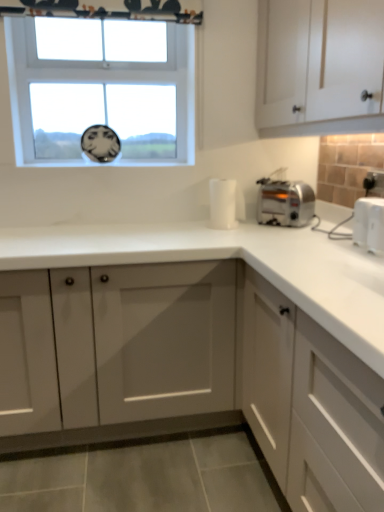
Question: Is white matte cabinet at lower right, the third cabinetry when ordered from top to bottom, to the left of white plastic toaster at right from the viewer's perspective?

Choices:
 (A) yes
 (B) no

Answer: (A)

Question: Can you confirm if white matte cabinet at lower right, the third cabinetry when ordered from top to bottom, is positioned to the right of white plastic toaster at right?

Choices:
 (A) yes
 (B) no

Answer: (B)

Question: From the image's perspective, is white matte cabinet at lower right, which is the 1th cabinetry from bottom to top, above white plastic toaster at right?

Choices:
 (A) no
 (B) yes

Answer: (A)

Question: Would you say white plastic toaster at right is part of white matte cabinet at lower right, which is the 1th cabinetry from bottom to top,'s contents?

Choices:
 (A) yes
 (B) no

Answer: (B)

Question: From the image's perspective, is clear glass window at upper center above or below white matte cabinet at lower right, which is the 1th cabinetry from bottom to top?

Choices:
 (A) above
 (B) below

Answer: (A)

Question: Is clear glass window at upper center situated inside white matte cabinet at lower right, which is the 1th cabinetry from bottom to top, or outside?

Choices:
 (A) inside
 (B) outside

Answer: (B)

Question: Does point (31, 46) appear closer or farther from the camera than point (284, 345)?

Choices:
 (A) farther
 (B) closer

Answer: (A)

Question: Is clear glass window at upper center taller or shorter than white matte cabinet at lower right, which is the 1th cabinetry from bottom to top?

Choices:
 (A) tall
 (B) short

Answer: (B)

Question: Relative to satin silver toaster at right, is clear glass window at upper center in front or behind?

Choices:
 (A) behind
 (B) front

Answer: (A)

Question: Is clear glass window at upper center wider or thinner than satin silver toaster at right?

Choices:
 (A) thin
 (B) wide

Answer: (A)

Question: Which is correct: clear glass window at upper center is inside satin silver toaster at right, or outside of it?

Choices:
 (A) inside
 (B) outside

Answer: (B)

Question: Visually, is clear glass window at upper center positioned to the left or to the right of satin silver toaster at right?

Choices:
 (A) right
 (B) left

Answer: (B)

Question: Is white plastic toaster at right inside or outside of white matte cabinet at lower right, which is the 1th cabinetry from bottom to top?

Choices:
 (A) outside
 (B) inside

Answer: (A)

Question: From a real-world perspective, is white plastic toaster at right positioned above or below white matte cabinet at lower right, which is the 1th cabinetry from bottom to top?

Choices:
 (A) below
 (B) above

Answer: (B)